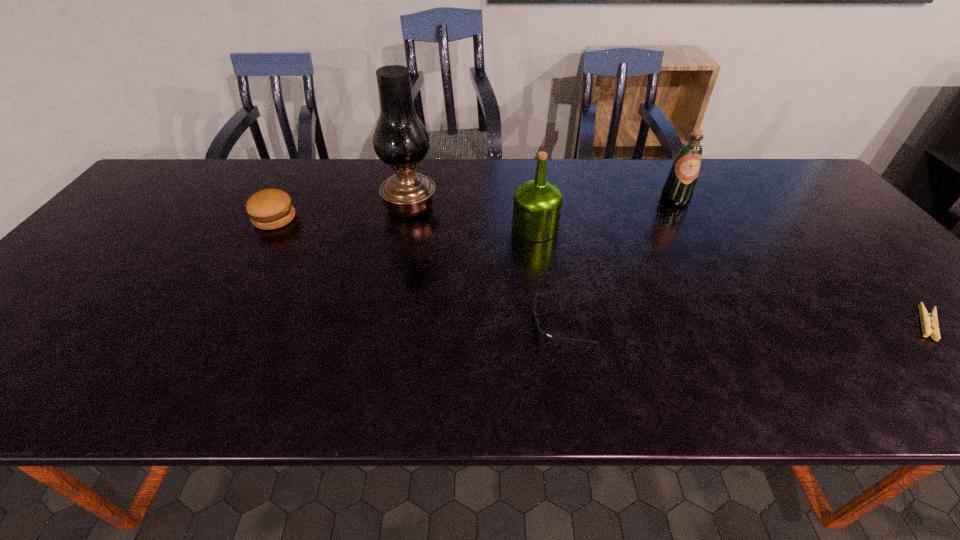
Locate an element on the screen. This screenshot has width=960, height=540. the tallest object is located at coordinates (400, 139).

Find the location of a particular element. The height and width of the screenshot is (540, 960). oil lamp is located at coordinates (400, 139).

In order to click on the left olive oil in this screenshot , I will do `click(537, 205)`.

Identify the location of the right olive oil. (678, 189).

This screenshot has height=540, width=960. In order to click on the fifth object from left to right in this screenshot , I will do `click(678, 189)`.

I want to click on hamburger, so click(x=269, y=209).

Identify the location of the third shortest object. This screenshot has height=540, width=960. (269, 209).

You are a GUI agent. You are given a task and a screenshot of the screen. Output one action in this format:
    pyautogui.click(x=<x>, y=<y>)
    Task: Click on the fifth tallest object
    The height and width of the screenshot is (540, 960).
    Given the screenshot: What is the action you would take?
    pyautogui.click(x=539, y=331)

Find the location of a particular element. free region located on the front of the tallest object is located at coordinates point(393,295).

Locate an element on the screen. Image resolution: width=960 pixels, height=540 pixels. vacant point located 0.380m on the left of the nearer olive oil is located at coordinates (372, 228).